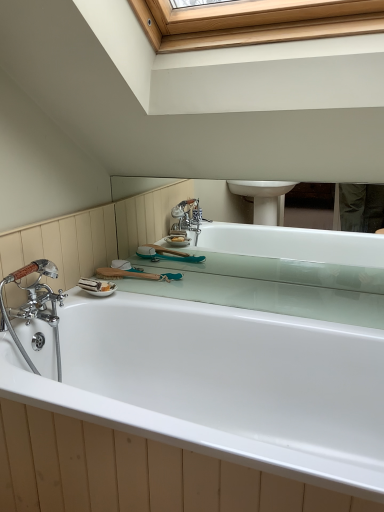
This screenshot has width=384, height=512. Find the location of `unoccupied region to the right of wooden handled brush at upper center`. unoccupied region to the right of wooden handled brush at upper center is located at coordinates (208, 281).